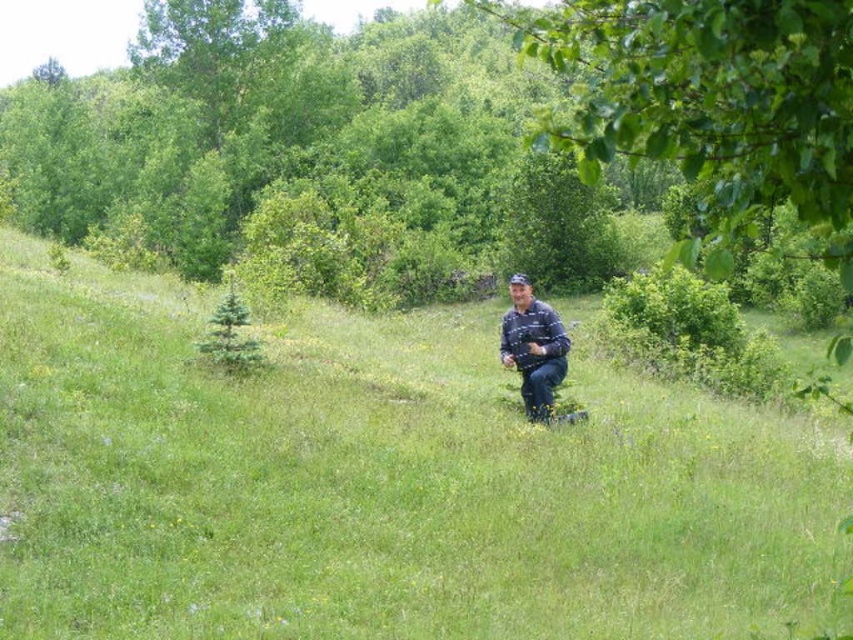
Question: Which point is farther to the camera?

Choices:
 (A) (524, 323)
 (B) (83, 426)

Answer: (A)

Question: Which point is closer to the camera?

Choices:
 (A) (526, 276)
 (B) (409, 595)

Answer: (B)

Question: Considering the relative positions of green grassy at center and blue denim jeans at center in the image provided, where is green grassy at center located with respect to blue denim jeans at center?

Choices:
 (A) left
 (B) right

Answer: (A)

Question: Is green grassy at center positioned at the back of blue denim jeans at center?

Choices:
 (A) no
 (B) yes

Answer: (A)

Question: Is green grassy at center above blue denim jeans at center?

Choices:
 (A) no
 (B) yes

Answer: (A)